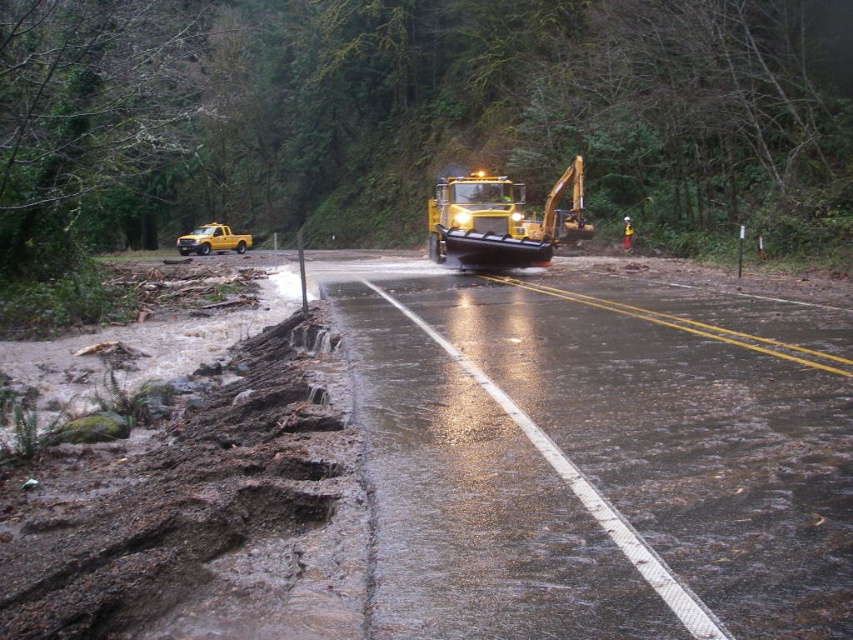
Question: Which object is positioned farthest from the yellow hard hat at center?

Choices:
 (A) yellow rubber excavator at center
 (B) wet asphalt road at center

Answer: (B)

Question: Is wet asphalt road at center bigger than yellow matte truck at left?

Choices:
 (A) no
 (B) yes

Answer: (A)

Question: Observing the image, what is the correct spatial positioning of wet asphalt road at center in reference to yellow rubber excavator at center?

Choices:
 (A) above
 (B) below

Answer: (B)

Question: Does yellow rubber excavator at center appear over yellow hard hat at center?

Choices:
 (A) no
 (B) yes

Answer: (B)

Question: Which object appears closest to the camera in this image?

Choices:
 (A) yellow hard hat at center
 (B) wet asphalt road at center

Answer: (B)

Question: Among these objects, which one is nearest to the camera?

Choices:
 (A) wet asphalt road at center
 (B) yellow rubber excavator at center
 (C) yellow matte truck at left
 (D) yellow hard hat at center

Answer: (A)